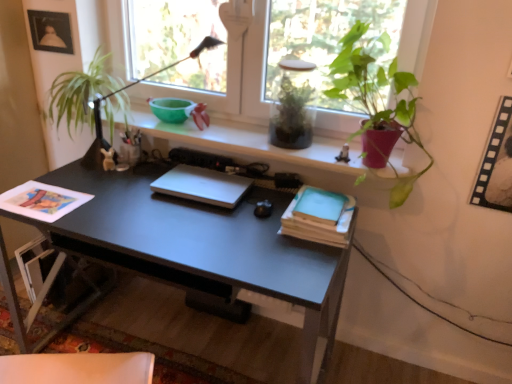
The width and height of the screenshot is (512, 384). I want to click on vacant space situated on the left part of light blue paper at center right, which ranks as the 2th paperback book in top-to-bottom order, so click(x=251, y=224).